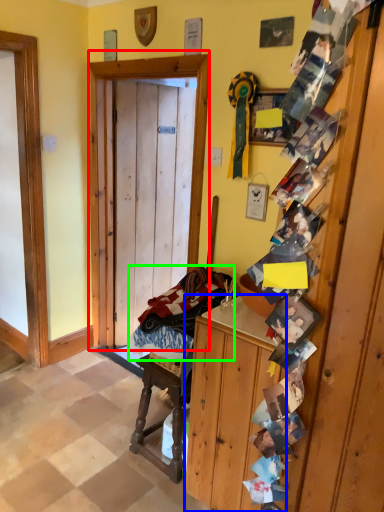
Question: Based on their relative distances, which object is nearer to door (highlighted by a red box)? Choose from cabinetry (highlighted by a blue box) and laundry (highlighted by a green box).

Choices:
 (A) cabinetry
 (B) laundry

Answer: (B)